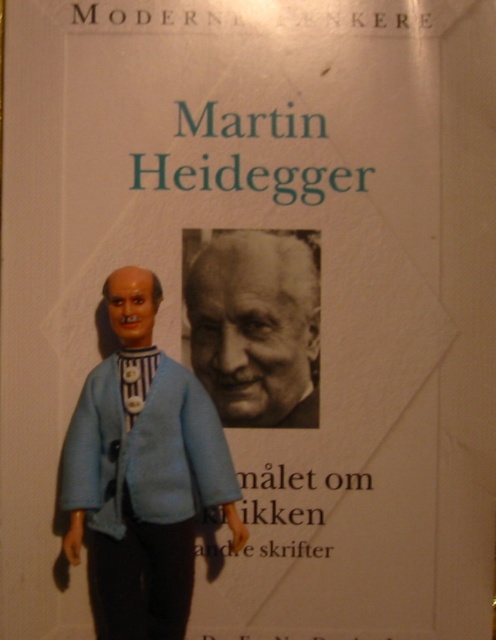
You are an art curator examining the book cover. You need to determine the spatial relationship between the matte blue fabric doll at center and the black and white photograph of martin heidegger at center. Which object is positioned in front?

The matte blue fabric doll at center is closer to the viewer than the black and white photograph of martin heidegger at center, so the matte blue fabric doll at center is positioned in front.

You are designing a book cover and need to place a matte blue fabric doll at center and a black and white photograph of martin heidegger at center. According to the existing layout, which object takes up more space?

The matte blue fabric doll at center is larger in size than the black and white photograph of martin heidegger at center, so the matte blue fabric doll at center takes up more space.